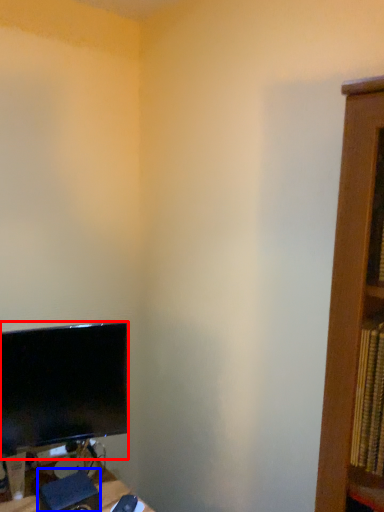
Question: Which object appears farthest to the camera in this image, computer monitor (highlighted by a red box) or speaker (highlighted by a blue box)?

Choices:
 (A) computer monitor
 (B) speaker

Answer: (A)